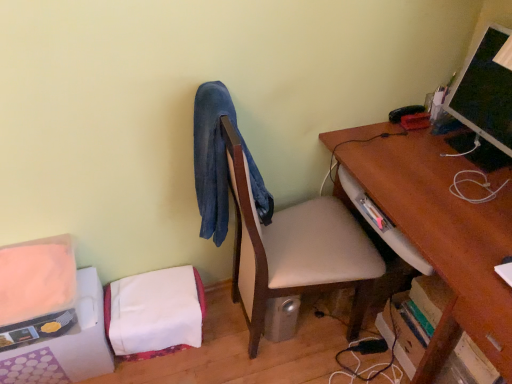
Question: Does wooden desk at center-right come in front of matte black monitor at upper right?

Choices:
 (A) no
 (B) yes

Answer: (B)

Question: From a real-world perspective, is wooden desk at center-right on top of matte black monitor at upper right?

Choices:
 (A) no
 (B) yes

Answer: (A)

Question: Is wooden desk at center-right to the right of matte black monitor at upper right from the viewer's perspective?

Choices:
 (A) yes
 (B) no

Answer: (B)

Question: Does wooden desk at center-right have a greater width compared to matte black monitor at upper right?

Choices:
 (A) no
 (B) yes

Answer: (B)

Question: Is wooden desk at center-right oriented towards matte black monitor at upper right?

Choices:
 (A) no
 (B) yes

Answer: (B)

Question: Looking at their shapes, would you say brown wood desk at right is wider or thinner than white fabric at lower left?

Choices:
 (A) wide
 (B) thin

Answer: (A)

Question: Visually, is brown wood desk at right positioned to the left or to the right of white fabric at lower left?

Choices:
 (A) right
 (B) left

Answer: (A)

Question: In terms of size, does brown wood desk at right appear bigger or smaller than white fabric at lower left?

Choices:
 (A) small
 (B) big

Answer: (B)

Question: From the image's perspective, is brown wood desk at right above or below white fabric at lower left?

Choices:
 (A) above
 (B) below

Answer: (A)

Question: Is white fabric at lower left taller or shorter than brown wood desk at right?

Choices:
 (A) short
 (B) tall

Answer: (A)

Question: Based on their sizes in the image, would you say white fabric at lower left is bigger or smaller than brown wood desk at right?

Choices:
 (A) small
 (B) big

Answer: (A)

Question: Is point (46, 291) closer or farther from the camera than point (417, 132)?

Choices:
 (A) closer
 (B) farther

Answer: (A)

Question: In terms of width, does white fabric at lower left look wider or thinner when compared to brown wood desk at right?

Choices:
 (A) wide
 (B) thin

Answer: (B)

Question: From a real-world perspective, relative to white fabric at lower left, is matte black monitor at upper right vertically above or below?

Choices:
 (A) above
 (B) below

Answer: (A)

Question: From their relative heights in the image, would you say matte black monitor at upper right is taller or shorter than white fabric at lower left?

Choices:
 (A) short
 (B) tall

Answer: (B)